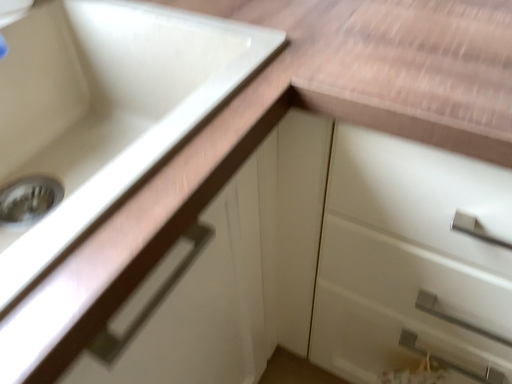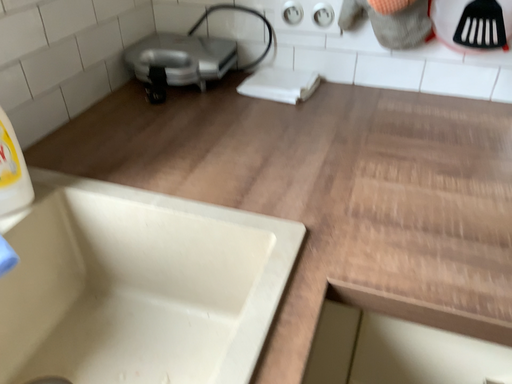
Question: How did the camera likely rotate when shooting the video?

Choices:
 (A) rotated right
 (B) rotated left

Answer: (A)